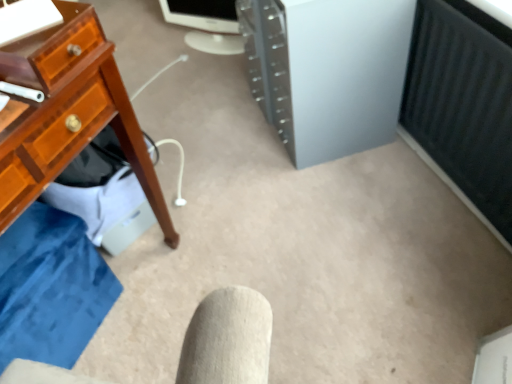
This screenshot has height=384, width=512. Describe the element at coordinates (206, 24) in the screenshot. I see `white glossy monitor at upper center` at that location.

Identify the location of white glossy monitor at upper center. This screenshot has width=512, height=384. (206, 24).

What do you see at coordinates (327, 71) in the screenshot? I see `satin silver tower at center` at bounding box center [327, 71].

Find the location of a particular element. This screenshot has height=384, width=512. satin silver tower at center is located at coordinates (327, 71).

Locate an element on the screen. white glossy monitor at upper center is located at coordinates (206, 24).

Between satin silver tower at center and white glossy monitor at upper center, which one appears on the right side from the viewer's perspective?

Positioned to the right is satin silver tower at center.

Is satin silver tower at center in front of or behind white glossy monitor at upper center in the image?

satin silver tower at center is in front of white glossy monitor at upper center.

Considering the positions of point (306, 108) and point (221, 25), is point (306, 108) closer or farther from the camera than point (221, 25)?

Point (306, 108) is closer to the camera than point (221, 25).

In the scene shown: From the image's perspective, relative to white glossy monitor at upper center, is satin silver tower at center above or below?

Clearly, from the image's perspective, satin silver tower at center is below white glossy monitor at upper center.

From a real-world perspective, is satin silver tower at center positioned under white glossy monitor at upper center based on gravity?

No.

Which of these two, satin silver tower at center or white glossy monitor at upper center, is wider?

With larger width is satin silver tower at center.

Considering the relative sizes of satin silver tower at center and white glossy monitor at upper center in the image provided, is satin silver tower at center shorter than white glossy monitor at upper center?

Incorrect, the height of satin silver tower at center does not fall short of that of white glossy monitor at upper center.

In the scene shown: Who is bigger, satin silver tower at center or white glossy monitor at upper center?

With larger size is satin silver tower at center.

Would you say satin silver tower at center is inside or outside white glossy monitor at upper center?

satin silver tower at center is not inside white glossy monitor at upper center, it's outside.

Is satin silver tower at center not near white glossy monitor at upper center?

satin silver tower at center is near white glossy monitor at upper center, not far away.

Could you tell me if satin silver tower at center is facing white glossy monitor at upper center?

No, satin silver tower at center is not oriented towards white glossy monitor at upper center.

I want to click on computer tower above the white glossy monitor at upper center (from a real-world perspective), so click(x=327, y=71).

Which is more to the right, white glossy monitor at upper center or satin silver tower at center?

satin silver tower at center is more to the right.

Which object is closer to the camera, white glossy monitor at upper center or satin silver tower at center?

Positioned in front is satin silver tower at center.

Which is closer, (237, 53) or (301, 142)?

Point (237, 53).

Consider the image. From the image's perspective, between white glossy monitor at upper center and satin silver tower at center, which one is located above?

white glossy monitor at upper center appears higher in the image.

From a real-world perspective, who is located lower, white glossy monitor at upper center or satin silver tower at center?

white glossy monitor at upper center.

Considering the sizes of objects white glossy monitor at upper center and satin silver tower at center in the image provided, who is wider, white glossy monitor at upper center or satin silver tower at center?

With larger width is satin silver tower at center.

Does white glossy monitor at upper center have a greater height compared to satin silver tower at center?

No, white glossy monitor at upper center is not taller than satin silver tower at center.

Looking at the image, does white glossy monitor at upper center seem bigger or smaller compared to satin silver tower at center?

Considering their sizes, white glossy monitor at upper center takes up less space than satin silver tower at center.

Which is correct: white glossy monitor at upper center is inside satin silver tower at center, or outside of it?

white glossy monitor at upper center is not inside satin silver tower at center, it's outside.

Is white glossy monitor at upper center placed right next to satin silver tower at center?

No.

Is white glossy monitor at upper center looking in the opposite direction of satin silver tower at center?

No, white glossy monitor at upper center is not facing the opposite direction of satin silver tower at center.

How different are the orientations of white glossy monitor at upper center and satin silver tower at center in degrees?

white glossy monitor at upper center and satin silver tower at center are facing 49 degrees away from each other.

I want to click on desktop computer on the left side of satin silver tower at center, so click(x=206, y=24).

Identify the location of computer tower located in front of the white glossy monitor at upper center. (327, 71).

Image resolution: width=512 pixels, height=384 pixels. Identify the location of desktop computer that appears above the satin silver tower at center (from the image's perspective). (206, 24).